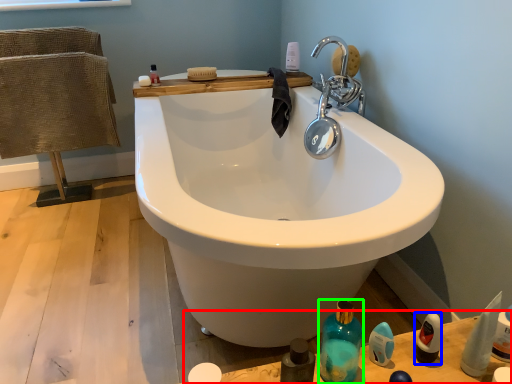
Question: Which is nearer to the counter top (highlighted by a red box)? mouthwash (highlighted by a blue box) or bottle (highlighted by a green box).

Choices:
 (A) mouthwash
 (B) bottle

Answer: (B)